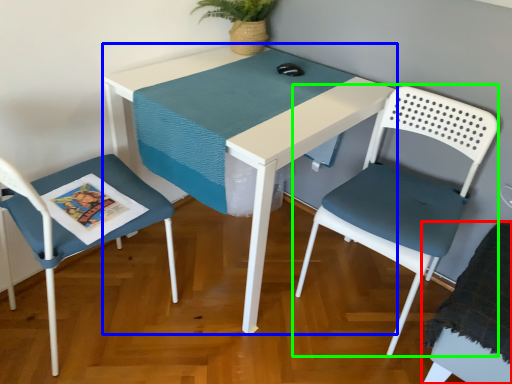
Question: Which object is the closest to the chair (highlighted by a red box)? Choose among these: table (highlighted by a blue box) or chair (highlighted by a green box).

Choices:
 (A) table
 (B) chair

Answer: (B)